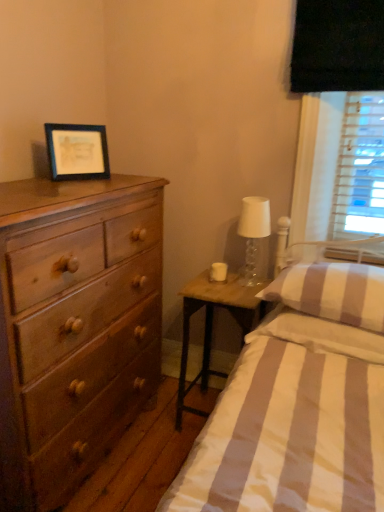
Question: Considering the relative positions of woodennightstand at right and translucent glass lampshade at right in the image provided, is woodennightstand at right to the left or to the right of translucent glass lampshade at right?

Choices:
 (A) right
 (B) left

Answer: (B)

Question: In terms of width, does woodennightstand at right look wider or thinner when compared to translucent glass lampshade at right?

Choices:
 (A) thin
 (B) wide

Answer: (B)

Question: Estimate the real-world distances between objects in this image. Which object is closer to the striped fabric pillow at right, which is counted as the first pillow, starting from the top?

Choices:
 (A) striped fabric pillow at right, the 2th pillow in the top-to-bottom sequence
 (B) translucent glass lampshade at right
 (C) matte brown dresser at left
 (D) woodennightstand at right
 (E) matte black picture frame at upper left

Answer: (A)

Question: Considering the real-world distances, which object is closest to the matte brown dresser at left?

Choices:
 (A) matte black picture frame at upper left
 (B) translucent glass lampshade at right
 (C) striped cotton bed at center
 (D) striped fabric pillow at right, which is counted as the first pillow, starting from the top
 (E) striped fabric pillow at right, the 1th pillow from the bottom

Answer: (A)